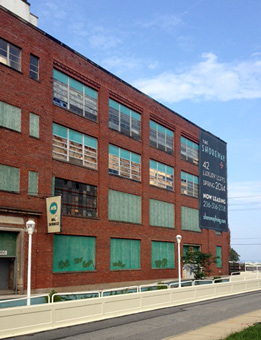
Locate an element on the screen. electric wire is located at coordinates (243, 244), (247, 238), (250, 207), (250, 201), (251, 195).